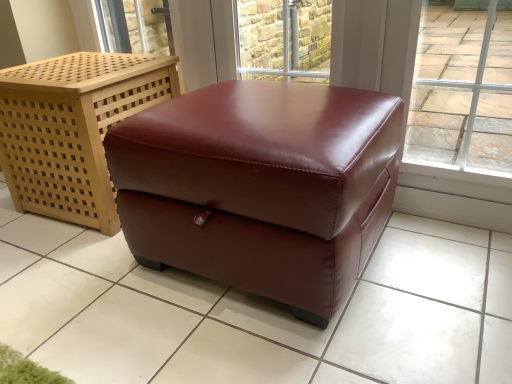
Question: Considering the relative sizes of glossy leather ottoman at center and burgundy leather ottoman at center in the image provided, is glossy leather ottoman at center smaller than burgundy leather ottoman at center?

Choices:
 (A) yes
 (B) no

Answer: (B)

Question: Is glossy leather ottoman at center bigger than burgundy leather ottoman at center?

Choices:
 (A) yes
 (B) no

Answer: (A)

Question: Is glossy leather ottoman at center not near burgundy leather ottoman at center?

Choices:
 (A) no
 (B) yes

Answer: (A)

Question: Does glossy leather ottoman at center turn towards burgundy leather ottoman at center?

Choices:
 (A) yes
 (B) no

Answer: (B)

Question: Is burgundy leather ottoman at center surrounded by glossy leather ottoman at center?

Choices:
 (A) no
 (B) yes

Answer: (A)

Question: From the image's perspective, is glossy leather ottoman at center located beneath burgundy leather ottoman at center?

Choices:
 (A) no
 (B) yes

Answer: (B)

Question: Is there a large distance between burgundy leather ottoman at center and glossy leather ottoman at center?

Choices:
 (A) yes
 (B) no

Answer: (B)

Question: Can you confirm if burgundy leather ottoman at center is positioned to the right of glossy leather ottoman at center?

Choices:
 (A) yes
 (B) no

Answer: (B)

Question: From a real-world perspective, is burgundy leather ottoman at center below glossy leather ottoman at center?

Choices:
 (A) no
 (B) yes

Answer: (B)

Question: From the image's perspective, is burgundy leather ottoman at center on top of glossy leather ottoman at center?

Choices:
 (A) yes
 (B) no

Answer: (A)

Question: Is burgundy leather ottoman at center surrounding glossy leather ottoman at center?

Choices:
 (A) yes
 (B) no

Answer: (B)

Question: Is the depth of burgundy leather ottoman at center greater than that of glossy leather ottoman at center?

Choices:
 (A) no
 (B) yes

Answer: (B)

Question: Considering the relative sizes of brick wall at upper center and glossy leather ottoman at center in the image provided, is brick wall at upper center smaller than glossy leather ottoman at center?

Choices:
 (A) no
 (B) yes

Answer: (B)